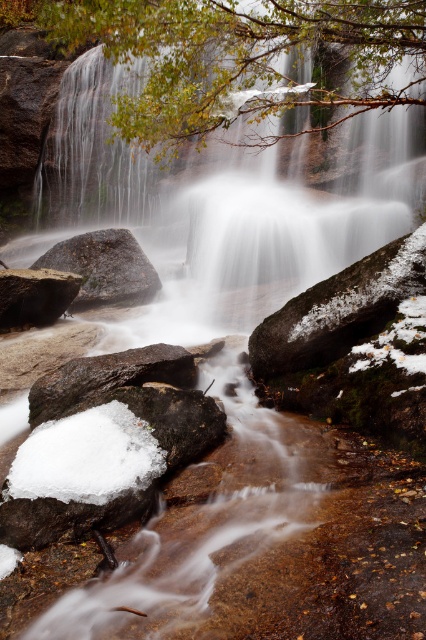
From the picture: Does snowy mossy rock at center have a smaller size compared to rusty metallic rock at center-left?

No.

Between snowy mossy rock at center and rusty metallic rock at center-left, which one has more height?

snowy mossy rock at center

Who is more distant from viewer, (290,330) or (92,374)?

The point (290,330) is behind.

This screenshot has width=426, height=640. Find the location of `snowy mossy rock at center`. snowy mossy rock at center is located at coordinates (339, 308).

Can you confirm if green leafy branch at upper center is taller than white fluffy snow at lower left?

No, green leafy branch at upper center is not taller than white fluffy snow at lower left.

Who is positioned more to the right, green leafy branch at upper center or white fluffy snow at lower left?

Positioned to the right is green leafy branch at upper center.

At what (x,y) coordinates should I click in order to perform the action: click on green leafy branch at upper center. Please return your answer as a coordinate pair (x, y). The width and height of the screenshot is (426, 640). Looking at the image, I should click on pyautogui.click(x=239, y=58).

Find the location of a particular element. green leafy branch at upper center is located at coordinates (239, 58).

Is green leafy branch at upper center wider than matte black rock at lower left?

No, green leafy branch at upper center is not wider than matte black rock at lower left.

Can you confirm if green leafy branch at upper center is positioned to the right of matte black rock at lower left?

Yes, green leafy branch at upper center is to the right of matte black rock at lower left.

Image resolution: width=426 pixels, height=640 pixels. Describe the element at coordinates (239, 58) in the screenshot. I see `green leafy branch at upper center` at that location.

In order to click on green leafy branch at upper center in this screenshot , I will do `click(239, 58)`.